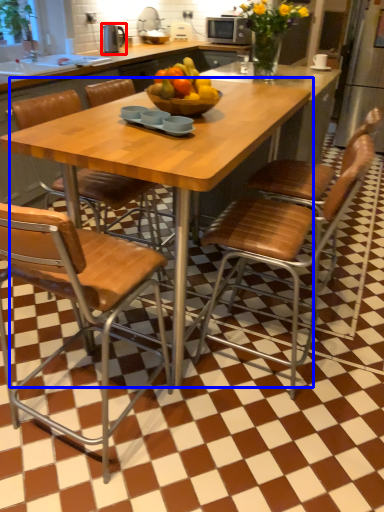
Question: Among these objects, which one is nearest to the camera, appliance (highlighted by a red box) or kitchen & dining room table (highlighted by a blue box)?

Choices:
 (A) appliance
 (B) kitchen & dining room table

Answer: (B)